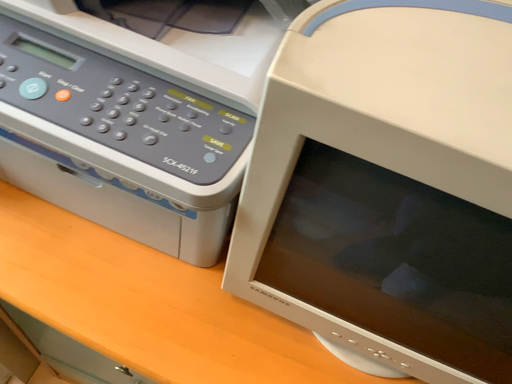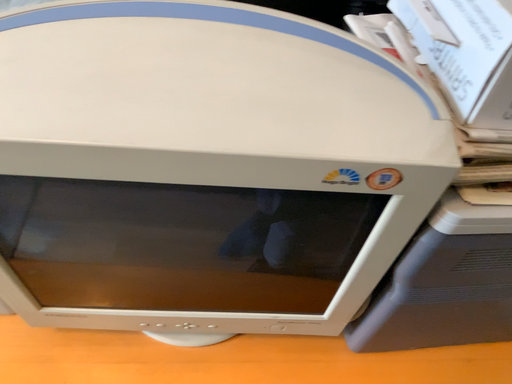
Question: Which way did the camera rotate in the video?

Choices:
 (A) rotated right
 (B) rotated left

Answer: (A)